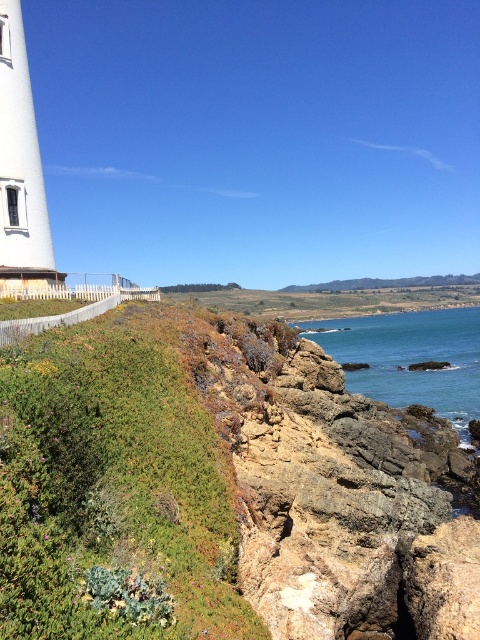
You are standing at the center of the image and want to walk towards the green grassy hillside at lower left. Which direction should you face to head directly towards it?

The green grassy hillside at lower left is located at point (x=224, y=486), so you should face towards the lower left direction to head directly towards it.